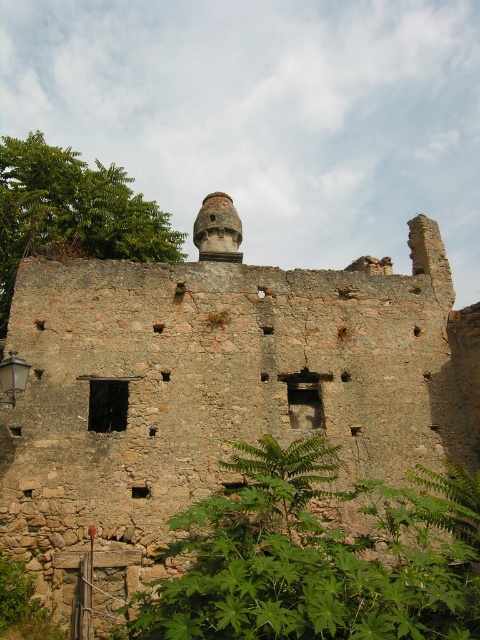
You are standing at a safe distance from the rustic stone ruins at center. If you want to take a photo of the entire structure without moving closer, what is the minimum distance you should maintain?

The rustic stone ruins at center and camera are 114.32 feet apart from each other, so the minimum distance you should maintain is 114.32 feet to capture the entire structure without moving closer.

You are standing at the entrance of the old stone structure and notice two points marked on the wall. The first point is at coordinates point (240, 358) and the second is at point (130, 212). Which point is closer to you as you face the wall?

Point (240, 358) is in front of point (130, 212), so it is closer to you when facing the wall.